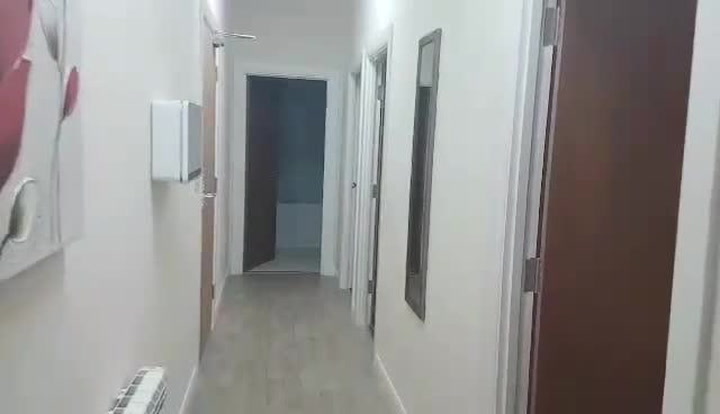
The width and height of the screenshot is (720, 414). Find the location of `utility cabinet`. utility cabinet is located at coordinates (184, 150).